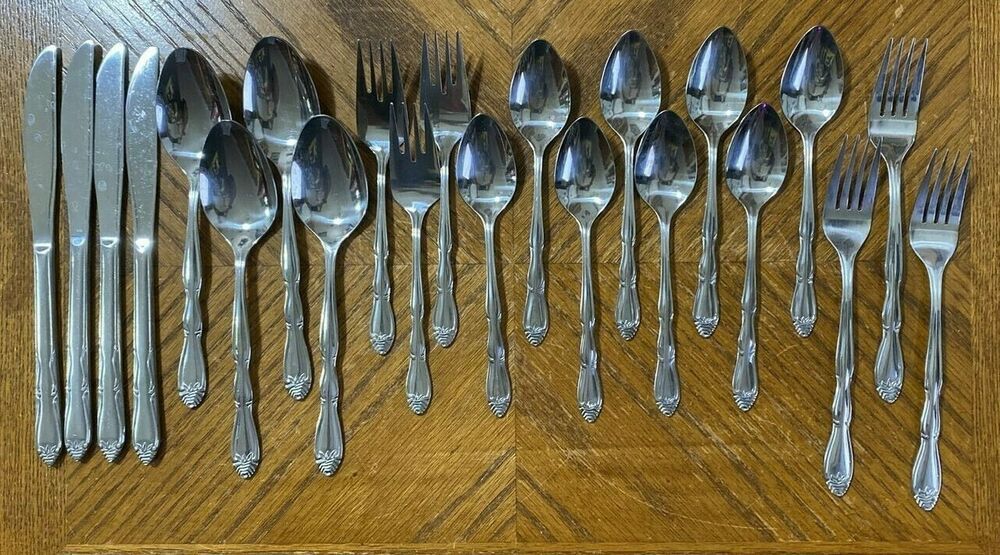
Find the location of a particular element. butter knives is located at coordinates (48, 406), (78, 385), (107, 391), (146, 401).